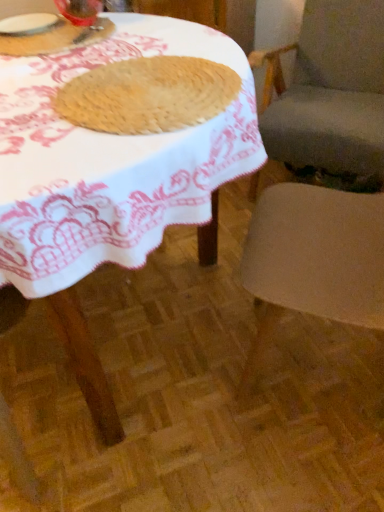
Question: Considering the relative sizes of wooden table at center and smooth beige chair at right, arranged as the 1th chair when viewed from the front, in the image provided, is wooden table at center shorter than smooth beige chair at right, arranged as the 1th chair when viewed from the front,?

Choices:
 (A) yes
 (B) no

Answer: (A)

Question: Is wooden table at center looking in the opposite direction of smooth beige chair at right, which is counted as the second chair, starting from the back?

Choices:
 (A) yes
 (B) no

Answer: (A)

Question: Can you see wooden table at center touching smooth beige chair at right, which is counted as the second chair, starting from the back?

Choices:
 (A) yes
 (B) no

Answer: (B)

Question: Considering the relative sizes of wooden table at center and smooth beige chair at right, which is counted as the second chair, starting from the back, in the image provided, is wooden table at center wider than smooth beige chair at right, which is counted as the second chair, starting from the back,?

Choices:
 (A) no
 (B) yes

Answer: (B)

Question: Can you confirm if wooden table at center is positioned to the right of smooth beige chair at right, arranged as the 1th chair when viewed from the front?

Choices:
 (A) yes
 (B) no

Answer: (B)

Question: From a real-world perspective, is wooden table at center located higher than smooth beige chair at right, arranged as the 1th chair when viewed from the front?

Choices:
 (A) no
 (B) yes

Answer: (B)

Question: Considering the relative positions of transparent glass at upper left, positioned as the second tableware in left-to-right order, and smooth beige chair at right, which is counted as the second chair, starting from the back, in the image provided, is transparent glass at upper left, positioned as the second tableware in left-to-right order, to the right of smooth beige chair at right, which is counted as the second chair, starting from the back, from the viewer's perspective?

Choices:
 (A) yes
 (B) no

Answer: (B)

Question: Does transparent glass at upper left, positioned as the second tableware in left-to-right order, lie behind smooth beige chair at right, which is counted as the second chair, starting from the back?

Choices:
 (A) yes
 (B) no

Answer: (A)

Question: From a real-world perspective, is transparent glass at upper left, positioned as the second tableware in left-to-right order, located beneath smooth beige chair at right, arranged as the 1th chair when viewed from the front?

Choices:
 (A) no
 (B) yes

Answer: (A)

Question: Does transparent glass at upper left, positioned as the second tableware in left-to-right order, have a larger size compared to smooth beige chair at right, which is counted as the second chair, starting from the back?

Choices:
 (A) yes
 (B) no

Answer: (B)

Question: Is transparent glass at upper left, positioned as the second tableware in left-to-right order, thinner than smooth beige chair at right, which is counted as the second chair, starting from the back?

Choices:
 (A) yes
 (B) no

Answer: (A)

Question: Can you confirm if transparent glass at upper left, the 1th tableware from the right, is smaller than smooth beige chair at right, arranged as the 1th chair when viewed from the front?

Choices:
 (A) no
 (B) yes

Answer: (B)

Question: Is smooth beige chair at right, arranged as the 1th chair when viewed from the front, to the right of smooth beige cushion at right, which is the 2th chair in front-to-back order, from the viewer's perspective?

Choices:
 (A) yes
 (B) no

Answer: (B)